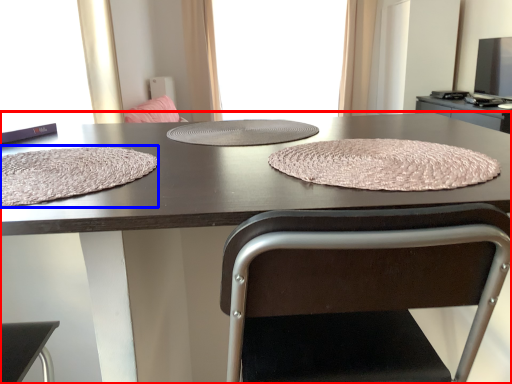
Question: Among these objects, which one is farthest to the camera, table (highlighted by a red box) or blanket (highlighted by a blue box)?

Choices:
 (A) table
 (B) blanket

Answer: (B)